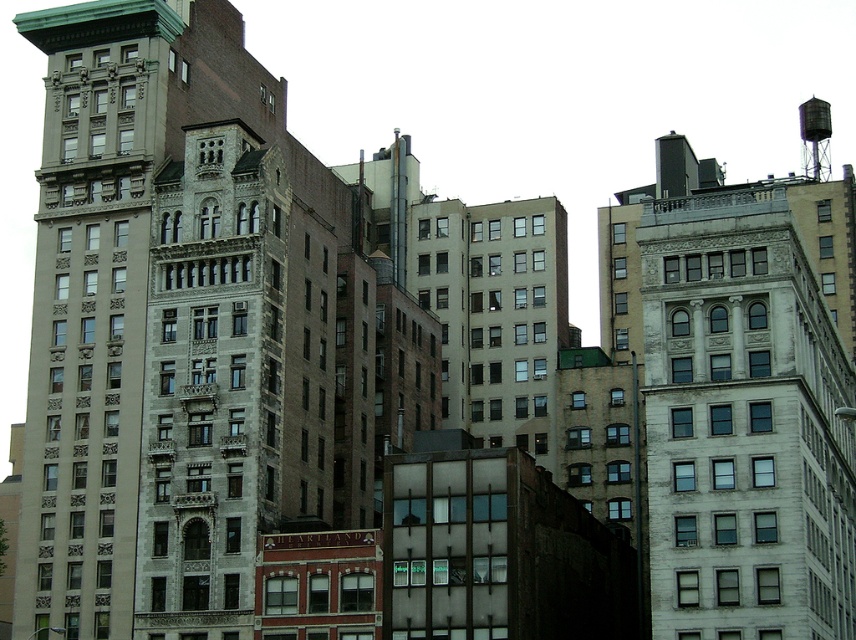
You are an urban planner reviewing this cityscape. You need to determine the spatial relationship between the white stone building at upper right and the gray stone building at center. From the perspective of someone standing in front of these buildings, which building is located above the other?

The white stone building at upper right is positioned under the gray stone building at center, so from the front view, the gray stone building at center is above the white stone building at upper right.

You are a city planner assessing the urban layout. You need to install a new communication tower that requires a minimum distance of 150 feet between existing structures. Given the beige stone building at left and the metallic gray water tower at upper right, can the proposed tower be placed between them without violating the distance requirement?

The beige stone building at left and metallic gray water tower at upper right are 175.20 feet apart. Since the required minimum distance is 150 feet, the proposed tower can be placed between them as the existing distance exceeds the requirement.

You are standing at the center of the urban landscape and want to locate the beige stone building at left. Based on the coordinates provided, in which direction should you look to find it?

The beige stone building at left is located at coordinates point (91,305), which means it is positioned to the left side of the scene. Therefore, you should look to your left to find it.